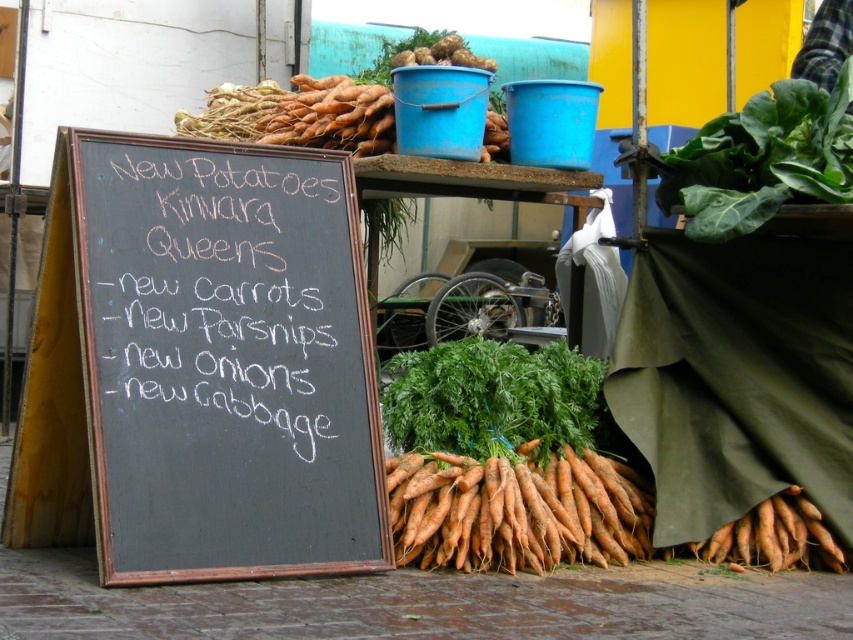
In the scene shown: Which is more to the right, black chalkboard at center or orange matte carrots at upper center?

orange matte carrots at upper center

Can you confirm if black chalkboard at center is thinner than orange matte carrots at upper center?

Incorrect, black chalkboard at center's width is not less than orange matte carrots at upper center's.

The width and height of the screenshot is (853, 640). In order to click on black chalkboard at center in this screenshot , I will do `click(225, 360)`.

I want to click on black chalkboard at center, so click(225, 360).

Can you confirm if orange matte carrots at center is thinner than orange matte carrots at upper center?

No.

Locate an element on the screen. The width and height of the screenshot is (853, 640). orange matte carrots at center is located at coordinates (515, 509).

Locate an element on the screen. The height and width of the screenshot is (640, 853). orange matte carrots at center is located at coordinates (515, 509).

Can you confirm if orange matte carrots at center is positioned to the left of green leafy carrot at center?

In fact, orange matte carrots at center is to the right of green leafy carrot at center.

Between orange matte carrots at center and green leafy carrot at center, which one has more height?

Standing taller between the two is green leafy carrot at center.

Is point (502, 497) behind point (483, 376)?

That is False.

Where is `orange matte carrots at center`? orange matte carrots at center is located at coordinates pyautogui.click(x=515, y=509).